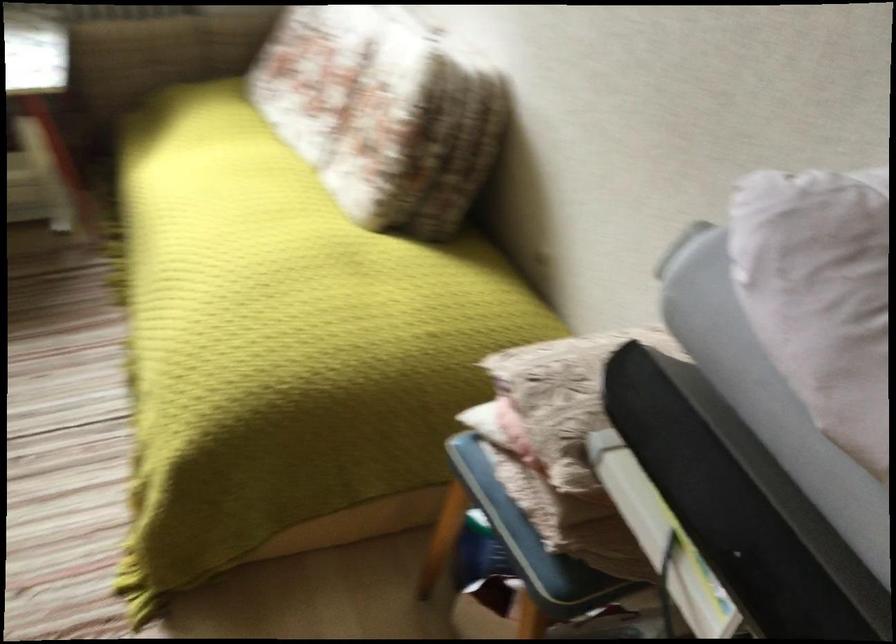
The height and width of the screenshot is (644, 896). What do you see at coordinates (382, 114) in the screenshot?
I see `the patterned cushion` at bounding box center [382, 114].